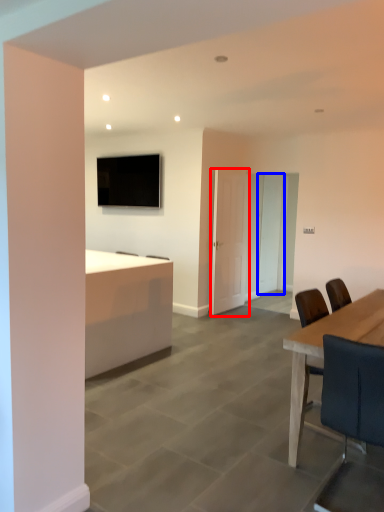
Question: Which point is closer to the camera, door (highlighted by a red box) or glass door (highlighted by a blue box)?

Choices:
 (A) door
 (B) glass door

Answer: (A)